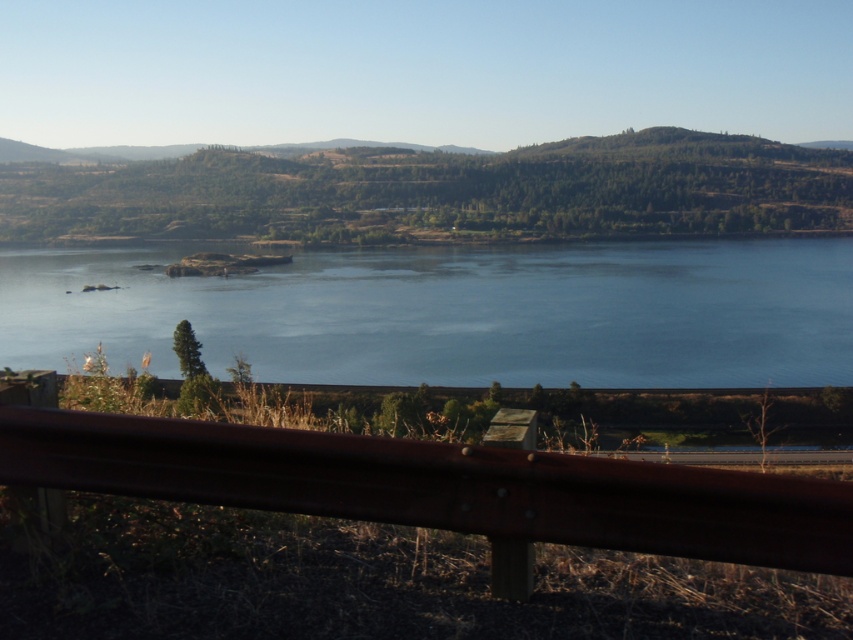
Between blue water at center and brown metallic rail at lower center, which one appears on the left side from the viewer's perspective?

brown metallic rail at lower center

Consider the image. Is blue water at center taller than brown metallic rail at lower center?

Incorrect, blue water at center's height is not larger of brown metallic rail at lower center's.

Which is behind, point (746, 360) or point (311, 509)?

Positioned behind is point (746, 360).

Where is `blue water at center`? The image size is (853, 640). blue water at center is located at coordinates (456, 314).